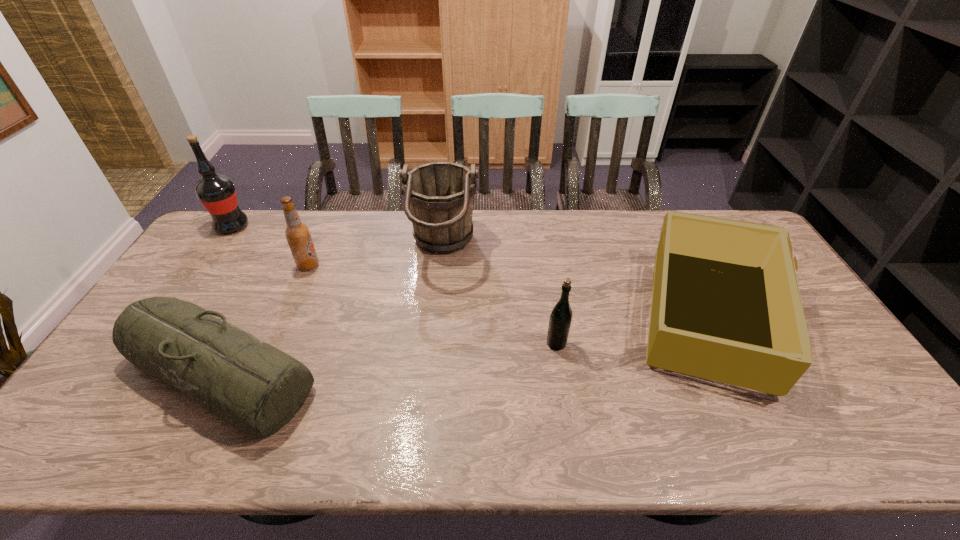
Find the location of a particular element. This screenshot has height=540, width=960. free spot between the fifth tallest object and the second object from right to left is located at coordinates (632, 331).

Identify the location of free space between the second shortest object and the farther beer bottle. This screenshot has width=960, height=540. (508, 292).

Where is `unoccupied position between the bucket and the fifth object from left to right`? The width and height of the screenshot is (960, 540). unoccupied position between the bucket and the fifth object from left to right is located at coordinates (499, 295).

Identify the location of unoccupied position between the bucket and the duffel bag. (331, 310).

Locate an element on the screen. free space between the bucket and the left beer bottle is located at coordinates (375, 256).

The image size is (960, 540). Identify the location of empty space that is in between the right beer bottle and the rightmost object. (632, 331).

Identify the location of object identified as the closest to the bucket. The height and width of the screenshot is (540, 960). point(256,388).

This screenshot has height=540, width=960. What are the coordinates of `object that is the second nearest to the duffel bag` in the screenshot? It's located at (439, 196).

The image size is (960, 540). I want to click on vacant space that satisfies the following two spatial constraints: 1. on the handle side of the bucket; 2. on the right side of the box, so click(436, 319).

Identify the location of free space in the image that satisfies the following two spatial constraints: 1. on the back side of the second object from right to left; 2. on the handle side of the bucket. The width and height of the screenshot is (960, 540). click(x=541, y=248).